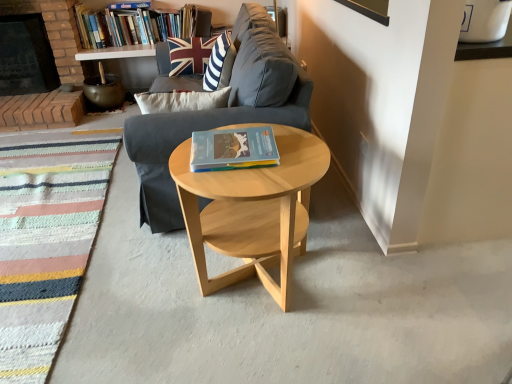
I want to click on free space above natural wood side table at center (from a real-world perspective), so click(x=248, y=168).